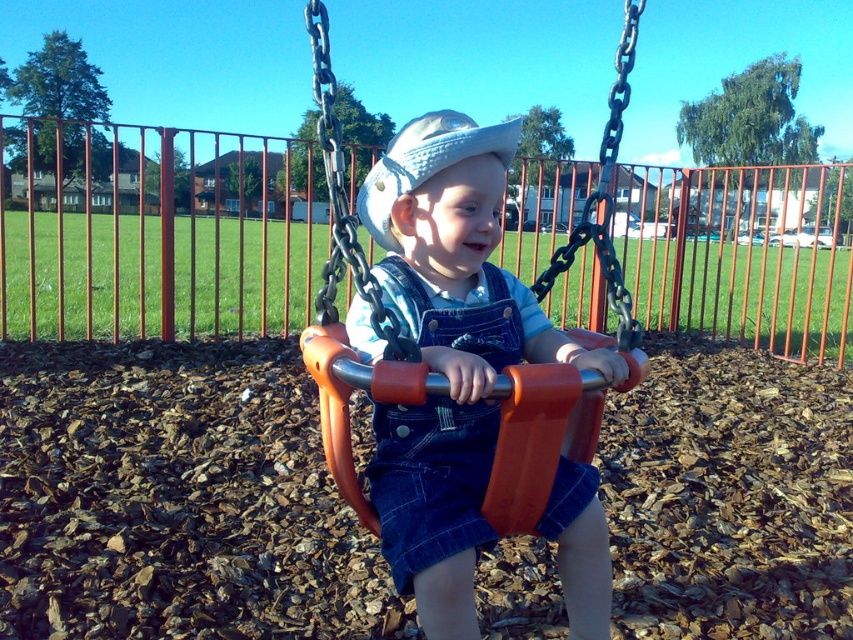
Can you confirm if denim overalls at center is wider than white fabric hat at center?

Indeed, denim overalls at center has a greater width compared to white fabric hat at center.

Locate an element on the screen. This screenshot has width=853, height=640. denim overalls at center is located at coordinates (450, 353).

Is point (399, 168) closer to camera compared to point (445, 131)?

That is True.

Locate an element on the screen. denim overalls at center is located at coordinates (450, 353).